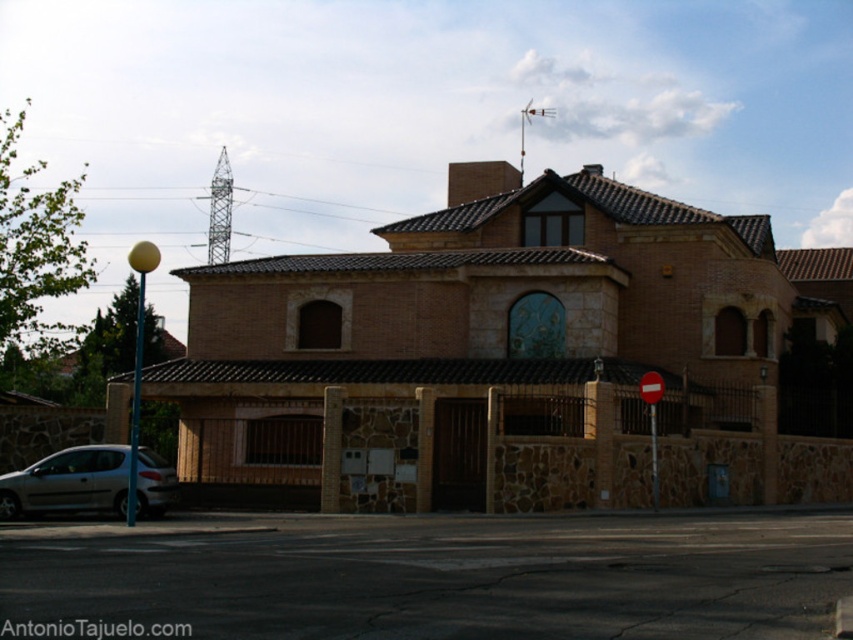
You are standing in front of the residential building and notice two points marked on the structure. The first point is at coordinate point (x=163, y=499) and the second is at point (x=648, y=378). Which of these two points is closer to your current position?

Point (x=163, y=499) is closer to the viewer than point (x=648, y=378).

You are driving a car and need to park in a space that is exactly the width of the red plastic stop sign at center. Can your silver metallic car at lower left fit into this parking space?

The silver metallic car at lower left might be wider than the red plastic stop sign at center, so there is a possibility that the car may not fit into the parking space.

Looking at this image, you are driving a car and see the silver metallic car at lower left and the red plastic stop sign at center. Which object is bigger in size?

The silver metallic car at lower left is larger in size compared to the red plastic stop sign at center.